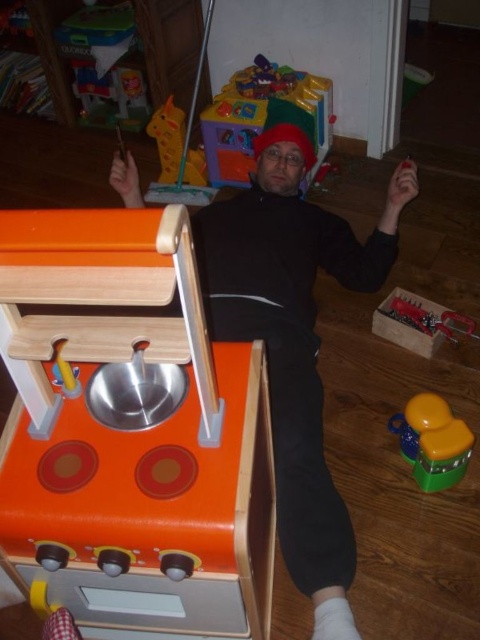
You are a photographer setting up a shot of the scene. You need to focus on the black matte clothing at center and the translucent green toy at lower right. Which object should you focus on first to ensure both are in sharp focus?

You should focus on the black matte clothing at center first since it is closer to the viewer than the translucent green toy at lower right, ensuring both are in sharp focus by starting with the closer object.

You are organizing a playroom and need to place the black matte clothing at center and the translucent green toy at lower right on a shelf. The shelf has a width of 1 meter. Can both items fit side by side without overlapping?

The black matte clothing at center is wider than the translucent green toy at lower right. Since the shelf is 1 meter wide, both items can fit side by side as long as their combined widths do not exceed 1 meter. However, without knowing the exact width of each item, it is impossible to determine definitively.